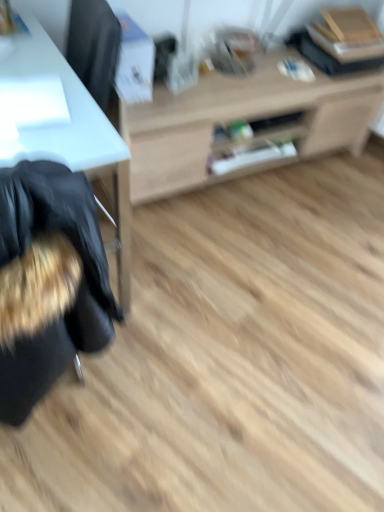
At what (x,y) coordinates should I click in order to perform the action: click on free area in between light wood cabinet at center and white glossy desk at left. Please return your answer as a coordinate pair (x, y). Looking at the image, I should click on (210, 226).